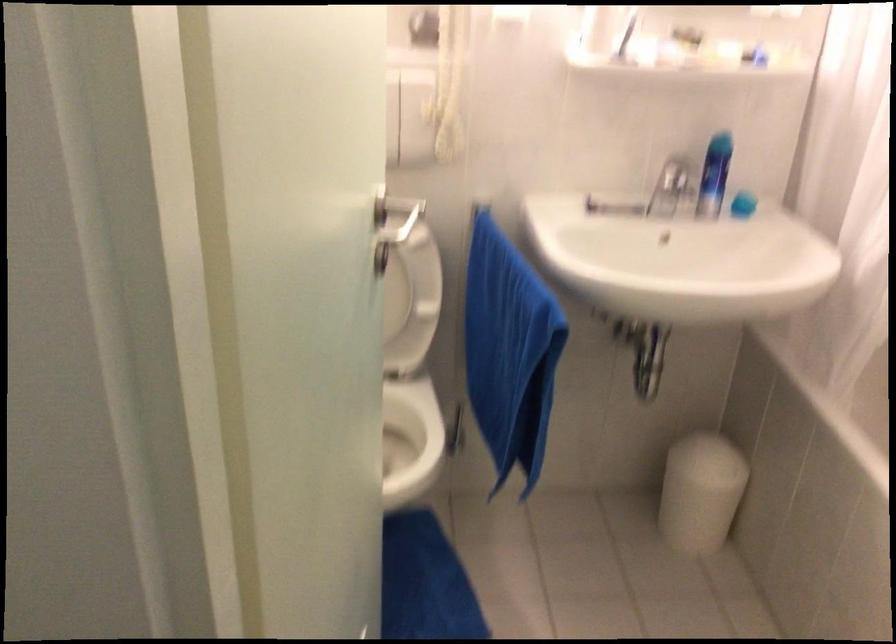
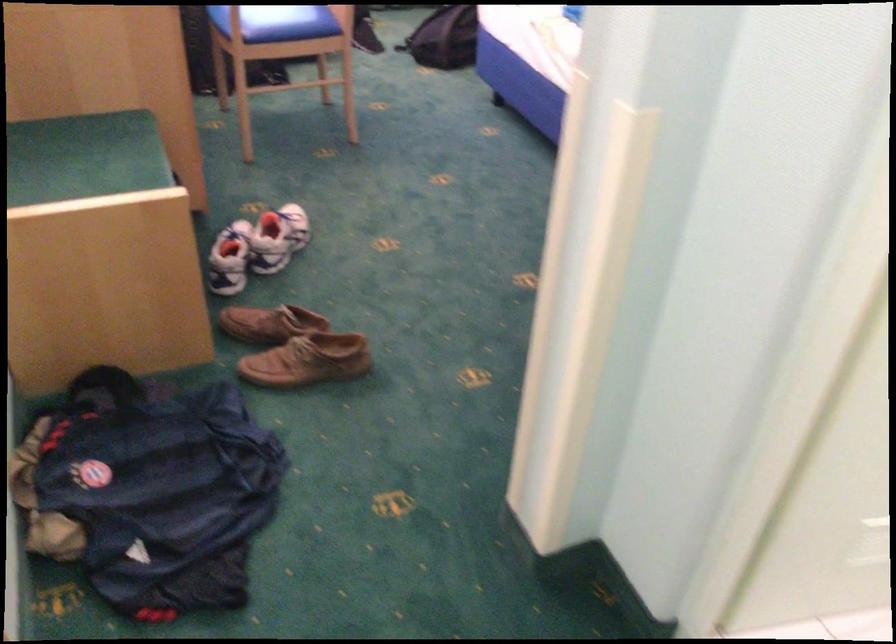
First-person continuous shooting, in which direction is the camera rotating?

The camera's rotation is toward left-down.